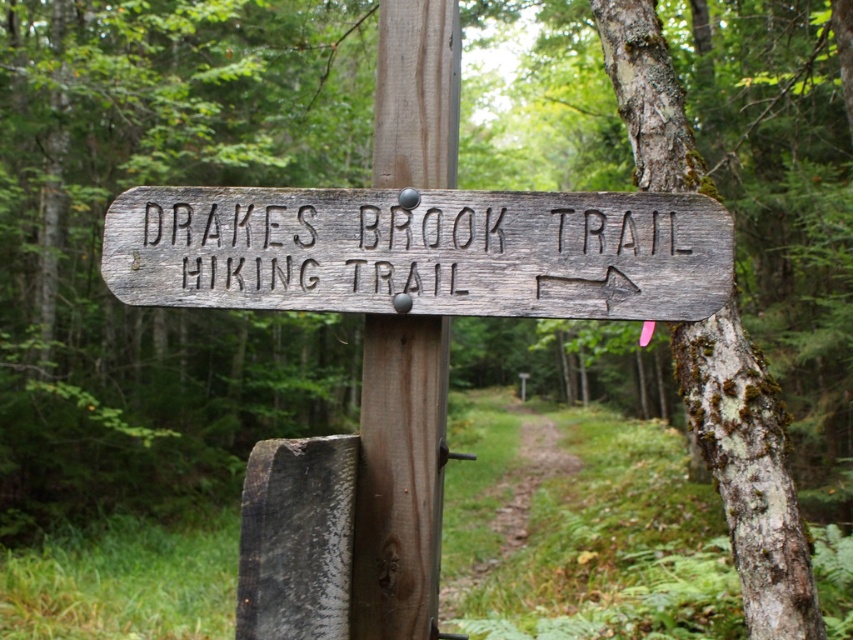
Question: Which point is closer to the camera?

Choices:
 (A) brown wood pole at center
 (B) dirt path at center

Answer: (A)

Question: Does weathered wood sign at center lie behind dirt path at center?

Choices:
 (A) yes
 (B) no

Answer: (B)

Question: Estimate the real-world distances between objects in this image. Which object is closer to the dirt path at center?

Choices:
 (A) brown wood pole at center
 (B) weathered wood sign at center

Answer: (A)

Question: Does brown wood pole at center come behind dirt path at center?

Choices:
 (A) no
 (B) yes

Answer: (A)

Question: Can you confirm if weathered wood sign at center is smaller than brown wood pole at center?

Choices:
 (A) yes
 (B) no

Answer: (B)

Question: Which point is closer to the camera?

Choices:
 (A) (511, 500)
 (B) (552, 220)

Answer: (B)